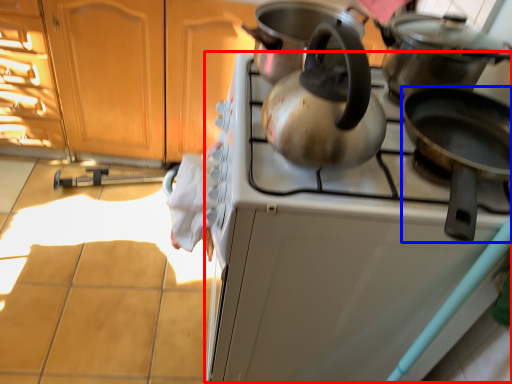
Question: Which of the following is the closest to the observer, oven (highlighted by a red box) or kitchen appliance (highlighted by a blue box)?

Choices:
 (A) oven
 (B) kitchen appliance

Answer: (B)